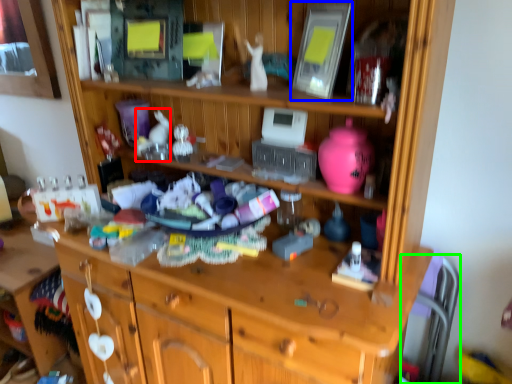
Question: Estimate the real-world distances between objects in this image. Which object is farther from toy (highlighted by a red box), picture frame (highlighted by a blue box) or chair (highlighted by a green box)?

Choices:
 (A) picture frame
 (B) chair

Answer: (B)